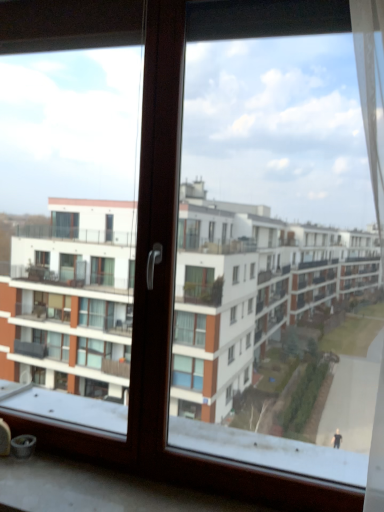
Locate an element on the screen. brown wood window at lower center is located at coordinates (97, 489).

Measure the distance between brown wood window at lower center and camera.

brown wood window at lower center and camera are 1.27 meters apart from each other.

What do you see at coordinates (97, 489) in the screenshot? The height and width of the screenshot is (512, 384). I see `brown wood window at lower center` at bounding box center [97, 489].

Identify the location of brown wood window at lower center. The width and height of the screenshot is (384, 512). (97, 489).